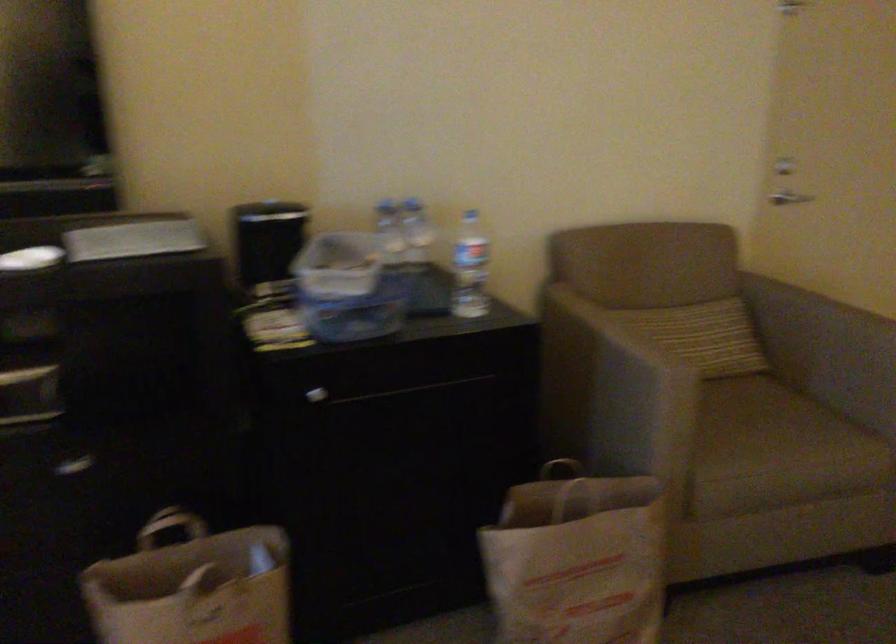
Locate an element on the screen. The height and width of the screenshot is (644, 896). silver cabinet knob is located at coordinates tap(316, 395).